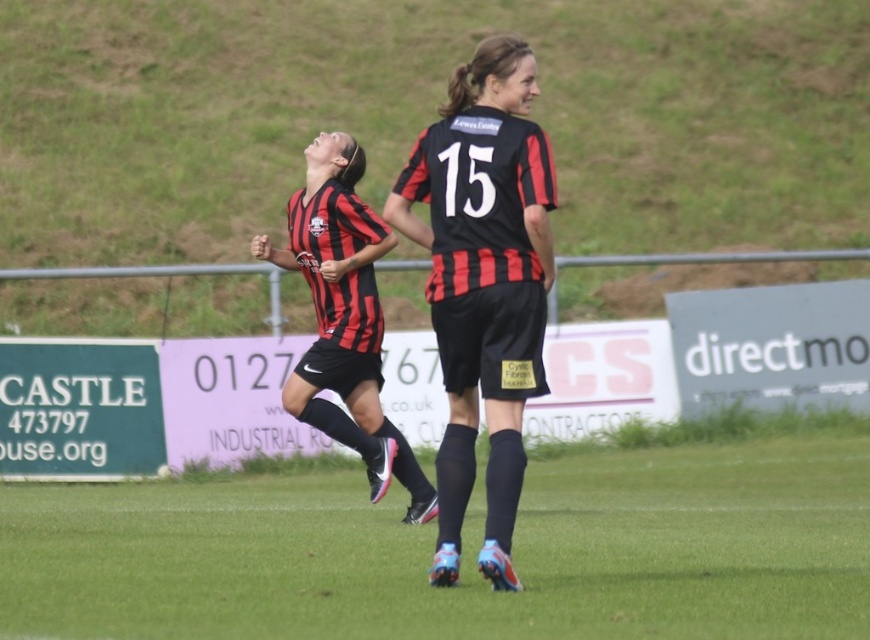
Does green grass at center have a lesser width compared to matte black jersey at center?

No.

Is green grass at center closer to the viewer compared to matte black jersey at center?

Yes, it is.

Describe the element at coordinates (462, 552) in the screenshot. This screenshot has height=640, width=870. I see `green grass at center` at that location.

At what (x,y) coordinates should I click in order to perform the action: click on green grass at center. Please return your answer as a coordinate pair (x, y). This screenshot has width=870, height=640. Looking at the image, I should click on (462, 552).

Can you confirm if matte black jersey at center is bigger than matte black soccer jersey at center?

Actually, matte black jersey at center might be smaller than matte black soccer jersey at center.

Is matte black jersey at center smaller than matte black soccer jersey at center?

Yes, matte black jersey at center is smaller than matte black soccer jersey at center.

You are a GUI agent. You are given a task and a screenshot of the screen. Output one action in this format:
    pyautogui.click(x=<x>, y=<y>)
    Task: Click on the matte black jersey at center
    The width and height of the screenshot is (870, 640).
    Given the screenshot: What is the action you would take?
    pyautogui.click(x=483, y=282)

Is green grass at center bigger than matte black soccer jersey at center?

Correct, green grass at center is larger in size than matte black soccer jersey at center.

Who is more forward, (x=146, y=496) or (x=286, y=256)?

Point (x=286, y=256)

The image size is (870, 640). What do you see at coordinates (462, 552) in the screenshot?
I see `green grass at center` at bounding box center [462, 552].

This screenshot has width=870, height=640. Identify the location of green grass at center. tap(462, 552).